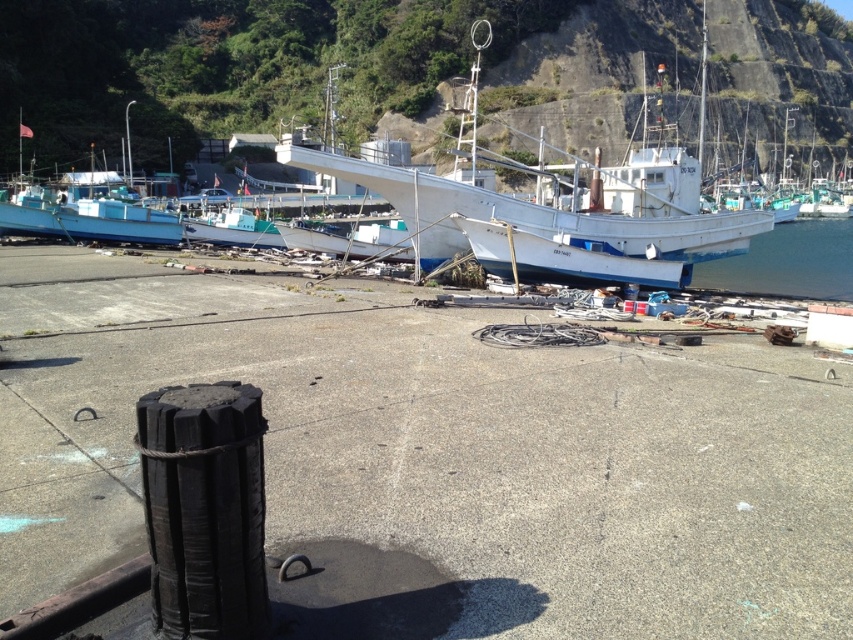
Question: Does brushed metal hillside at upper center appear on the right side of white matte boat at center?

Choices:
 (A) yes
 (B) no

Answer: (A)

Question: Which point is closer to the camera?

Choices:
 (A) (846, 262)
 (B) (10, 157)

Answer: (A)

Question: Is the position of brushed metal hillside at upper center less distant than that of white matte boat at center?

Choices:
 (A) yes
 (B) no

Answer: (B)

Question: From the image, what is the correct spatial relationship of brushed metal hillside at upper center in relation to white matte boat at center?

Choices:
 (A) left
 (B) right

Answer: (B)

Question: Among these points, which one is nearest to the camera?

Choices:
 (A) (207, 109)
 (B) (344, 156)

Answer: (B)

Question: Among these objects, which one is nearest to the camera?

Choices:
 (A) clear water at lower right
 (B) brushed metal hillside at upper center
 (C) white matte boat at center

Answer: (C)